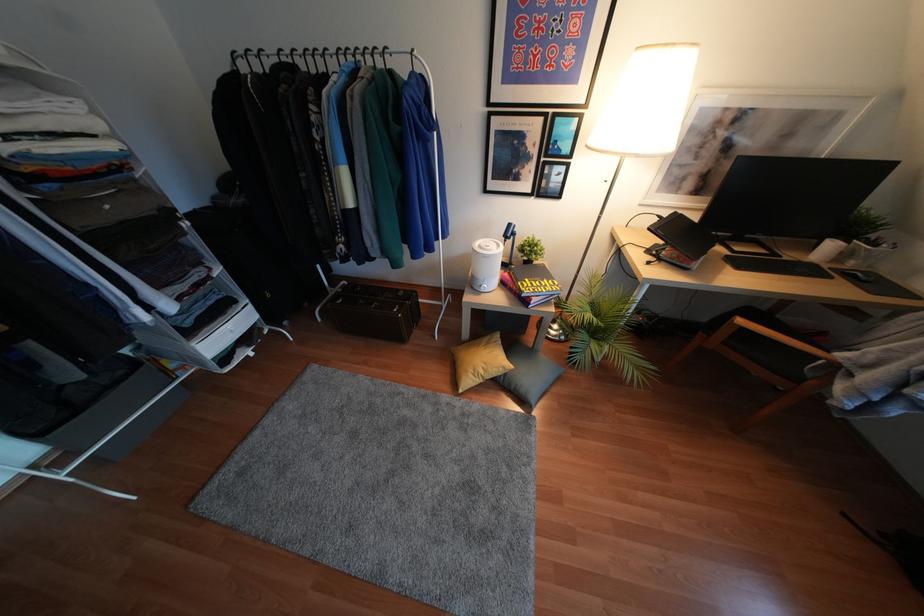
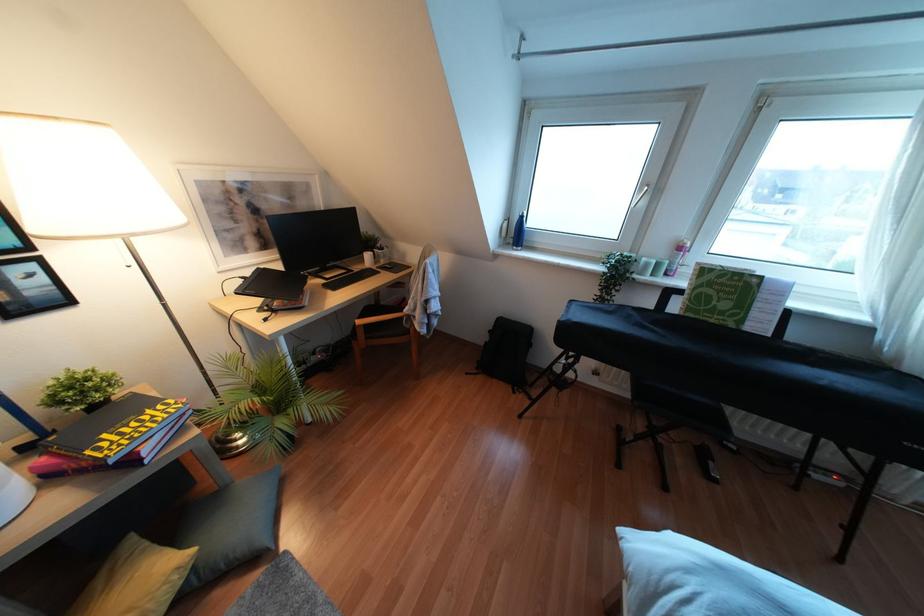
Question: The camera is either moving clockwise (left) or counter-clockwise (right) around the object. The first image is from the beginning of the video and the second image is from the end. Is the camera moving left or right when shooting the video?

Choices:
 (A) Left
 (B) Right

Answer: (A)